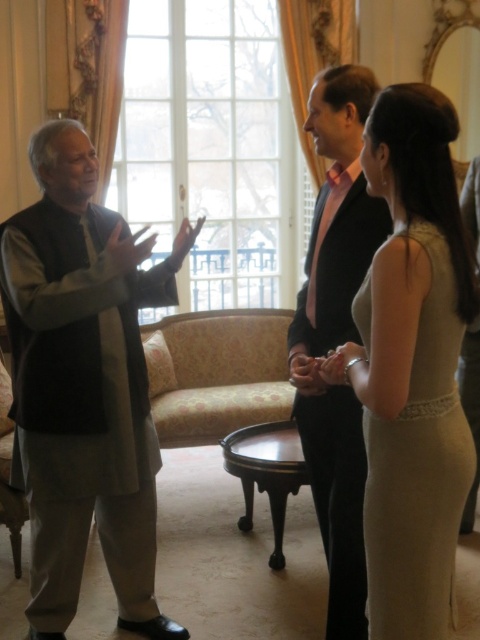
In the formal scene, you notice two people dressed in a matte black suit at center and a satin beige dress at right. Which one is taller?

The matte black suit at center is taller than the satin beige dress at right.

You are planning to rent a space for a photoshoot and need to know if the matte black suit at center and the satin beige dress at right can fit side by side in a 1.8 meter wide space. Can they fit?

The matte black suit at center is bigger than the satin beige dress at right, but their exact widths are not provided. Without knowing their specific dimensions, it is impossible to determine if they can fit side by side in a 1.8 meter wide space.

Based on the scene description, which object is larger in size between the matte gray vest at left and the matte black suit at center?

The matte gray vest at left is larger in size compared to the matte black suit at center according to the description.